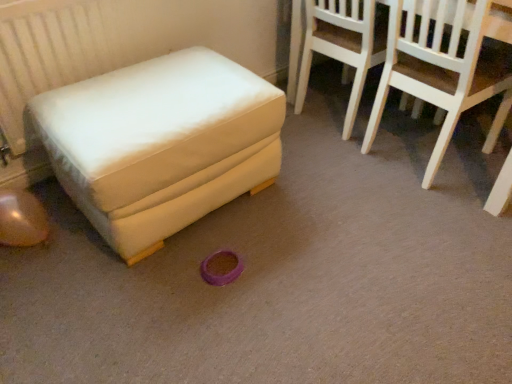
From the picture: What is the approximate width of light wood chair at upper right, the 2th chair in the right-to-left sequence?

It is 20.13 inches.

Where is `light wood chair at upper right, positioned as the first chair in left-to-right order`? The height and width of the screenshot is (384, 512). light wood chair at upper right, positioned as the first chair in left-to-right order is located at coordinates (342, 46).

From the image's perspective, starting from the white fabric ottoman at left, which chair is the 1st one above? Please provide its 2D coordinates.

[(440, 70)]

Which is less distant, (174, 100) or (490, 145)?

The point (174, 100) is closer.

Which of these two, white fabric ottoman at left or white wood chair at upper right, acting as the first chair starting from the right, is smaller?

With smaller size is white wood chair at upper right, acting as the first chair starting from the right.

Is white fabric ottoman at left positioned beyond the bounds of light wood chair at upper right, positioned as the first chair in left-to-right order?

Absolutely, white fabric ottoman at left is external to light wood chair at upper right, positioned as the first chair in left-to-right order.

Considering the points (63, 118) and (321, 50), which point is behind, point (63, 118) or point (321, 50)?

Point (321, 50)

From the image's perspective, which chair is the 2nd one above the white fabric ottoman at left? Please provide its 2D coordinates.

[(342, 46)]

From a real-world perspective, who is located higher, white fabric ottoman at left or light wood chair at upper right, positioned as the first chair in left-to-right order?

light wood chair at upper right, positioned as the first chair in left-to-right order, is physically above.

Would you consider white wood chair at upper right, acting as the first chair starting from the right, to be distant from white fabric ottoman at left?

That's not correct — white wood chair at upper right, acting as the first chair starting from the right, is a little close to white fabric ottoman at left.

Is white fabric ottoman at left surrounded by white wood chair at upper right, the second chair from the left?

No, white fabric ottoman at left is located outside of white wood chair at upper right, the second chair from the left.

Does white wood chair at upper right, acting as the first chair starting from the right, have a lesser width compared to white fabric ottoman at left?

Yes, white wood chair at upper right, acting as the first chair starting from the right, is thinner than white fabric ottoman at left.

Can you tell me how much white wood chair at upper right, acting as the first chair starting from the right, and white fabric ottoman at left differ in facing direction?

They differ by 89.9 degrees in their facing directions.

Is white wood chair at upper right, the second chair from the left, facing towards light wood chair at upper right, the 2th chair in the right-to-left sequence?

No, white wood chair at upper right, the second chair from the left, is not turned towards light wood chair at upper right, the 2th chair in the right-to-left sequence.

Is white wood chair at upper right, acting as the first chair starting from the right, taller than light wood chair at upper right, positioned as the first chair in left-to-right order?

Correct, white wood chair at upper right, acting as the first chair starting from the right, is much taller as light wood chair at upper right, positioned as the first chair in left-to-right order.

What's the angular difference between white wood chair at upper right, the second chair from the left, and light wood chair at upper right, positioned as the first chair in left-to-right order,'s facing directions?

3.45 degrees.

Based on the photo, considering the sizes of white wood chair at upper right, the second chair from the left, and light wood chair at upper right, the 2th chair in the right-to-left sequence, in the image, is white wood chair at upper right, the second chair from the left, bigger or smaller than light wood chair at upper right, the 2th chair in the right-to-left sequence,?

In the image, white wood chair at upper right, the second chair from the left, appears to be larger than light wood chair at upper right, the 2th chair in the right-to-left sequence.

Relative to white wood chair at upper right, acting as the first chair starting from the right, is light wood chair at upper right, the 2th chair in the right-to-left sequence, in front or behind?

Visually, light wood chair at upper right, the 2th chair in the right-to-left sequence, is located behind white wood chair at upper right, acting as the first chair starting from the right.

From the image's perspective, between light wood chair at upper right, the 2th chair in the right-to-left sequence, and white wood chair at upper right, acting as the first chair starting from the right, which one is located above?

light wood chair at upper right, the 2th chair in the right-to-left sequence.

Is light wood chair at upper right, the 2th chair in the right-to-left sequence, smaller than white wood chair at upper right, acting as the first chair starting from the right?

Correct, light wood chair at upper right, the 2th chair in the right-to-left sequence, occupies less space than white wood chair at upper right, acting as the first chair starting from the right.

Could you tell me if light wood chair at upper right, positioned as the first chair in left-to-right order, is facing white wood chair at upper right, the second chair from the left?

No, light wood chair at upper right, positioned as the first chair in left-to-right order, is not turned towards white wood chair at upper right, the second chair from the left.

This screenshot has width=512, height=384. In the image, there is a light wood chair at upper right, positioned as the first chair in left-to-right order. What are the coordinates of `furniture below it (from a real-world perspective)` in the screenshot? It's located at (161, 143).

Can you confirm if light wood chair at upper right, positioned as the first chair in left-to-right order, is wider than white fabric ottoman at left?

Incorrect, the width of light wood chair at upper right, positioned as the first chair in left-to-right order, does not surpass that of white fabric ottoman at left.

How different are the orientations of light wood chair at upper right, positioned as the first chair in left-to-right order, and white fabric ottoman at left in degrees?

The angle between the facing direction of light wood chair at upper right, positioned as the first chair in left-to-right order, and the facing direction of white fabric ottoman at left is 93.3 degrees.

Identify the location of furniture located on the left of white wood chair at upper right, acting as the first chair starting from the right. (161, 143).

You are a GUI agent. You are given a task and a screenshot of the screen. Output one action in this format:
    pyautogui.click(x=<x>, y=<y>)
    Task: Click on the 2nd chair behind when counting from the white fabric ottoman at left
    
    Given the screenshot: What is the action you would take?
    pyautogui.click(x=342, y=46)

Looking at this image, looking at the image, which one is located further to white wood chair at upper right, acting as the first chair starting from the right, light wood chair at upper right, positioned as the first chair in left-to-right order, or white fabric ottoman at left?

white fabric ottoman at left.

Based on the photo, estimate the real-world distances between objects in this image. Which object is further from light wood chair at upper right, the 2th chair in the right-to-left sequence, white fabric ottoman at left or white wood chair at upper right, the second chair from the left?

white fabric ottoman at left.

Which object lies nearer to the anchor point white fabric ottoman at left, white wood chair at upper right, acting as the first chair starting from the right, or light wood chair at upper right, positioned as the first chair in left-to-right order?

Based on the image, white wood chair at upper right, acting as the first chair starting from the right, appears to be nearer to white fabric ottoman at left.

Based on the photo, when comparing their distances from white wood chair at upper right, the second chair from the left, does white fabric ottoman at left or light wood chair at upper right, positioned as the first chair in left-to-right order, seem closer?

light wood chair at upper right, positioned as the first chair in left-to-right order, lies closer to white wood chair at upper right, the second chair from the left, than the other object.

From the picture: Looking at the image, which one is located further to light wood chair at upper right, the 2th chair in the right-to-left sequence, white wood chair at upper right, the second chair from the left, or white fabric ottoman at left?

white fabric ottoman at left lies further to light wood chair at upper right, the 2th chair in the right-to-left sequence, than the other object.

From the image, which object appears to be nearer to white fabric ottoman at left, light wood chair at upper right, the 2th chair in the right-to-left sequence, or white wood chair at upper right, acting as the first chair starting from the right?

The object closer to white fabric ottoman at left is white wood chair at upper right, acting as the first chair starting from the right.

Locate an element on the screen. chair between white fabric ottoman at left and white wood chair at upper right, the second chair from the left, in the horizontal direction is located at coordinates (342, 46).